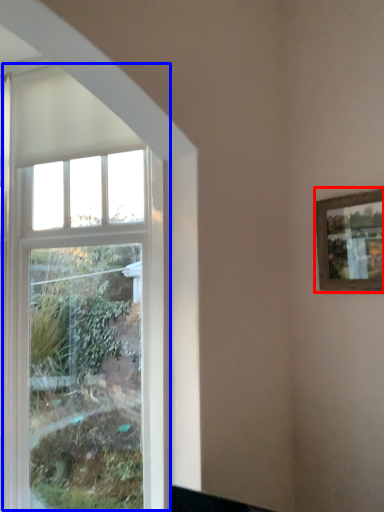
Question: Which point is closer to the camera, picture frame (highlighted by a red box) or window (highlighted by a blue box)?

Choices:
 (A) picture frame
 (B) window

Answer: (A)